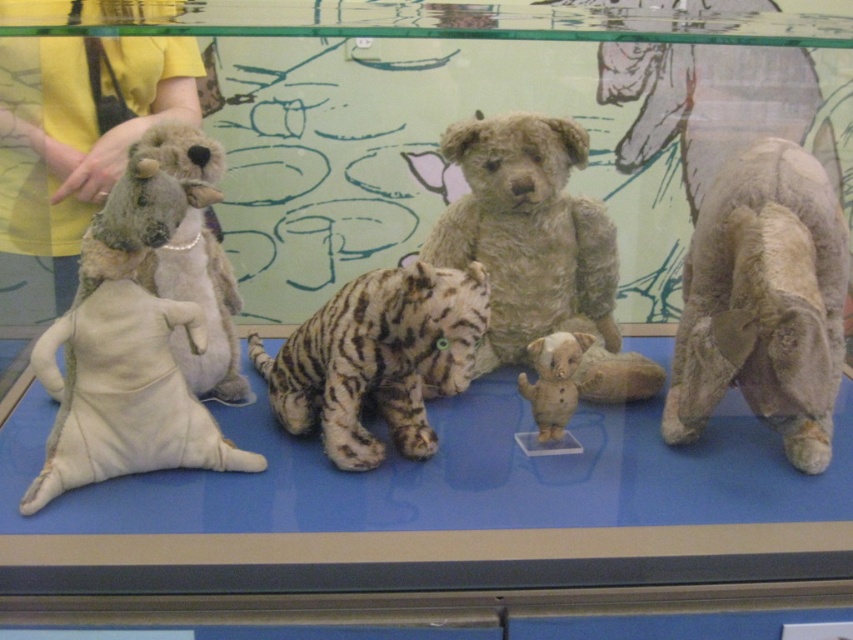
You are a toy collector who wants to place a new 12 inch tall stuffed giraffe between the white plush kangaroo at left and the white plush elephant at center in the display case. Based on the spacing between them, will the giraffe fit without overlapping either toy?

The distance between the white plush kangaroo at left and the white plush elephant at center is 14.58 inches. Since the giraffe is 12 inches tall, it should fit between them as the space is larger than the giraffe.

You are a visitor standing in front of the display case. You want to take a photo of both the fuzzy beige bear at right and the white plush kangaroo at left. Which one should you position closer to the center of your camera frame to include both in the photo?

The fuzzy beige bear at right is to the right of the white plush kangaroo at left. To include both in the photo, position the white plush kangaroo at left closer to the center of your camera frame since it is on the left side and the bear is on the right, balancing their positions.